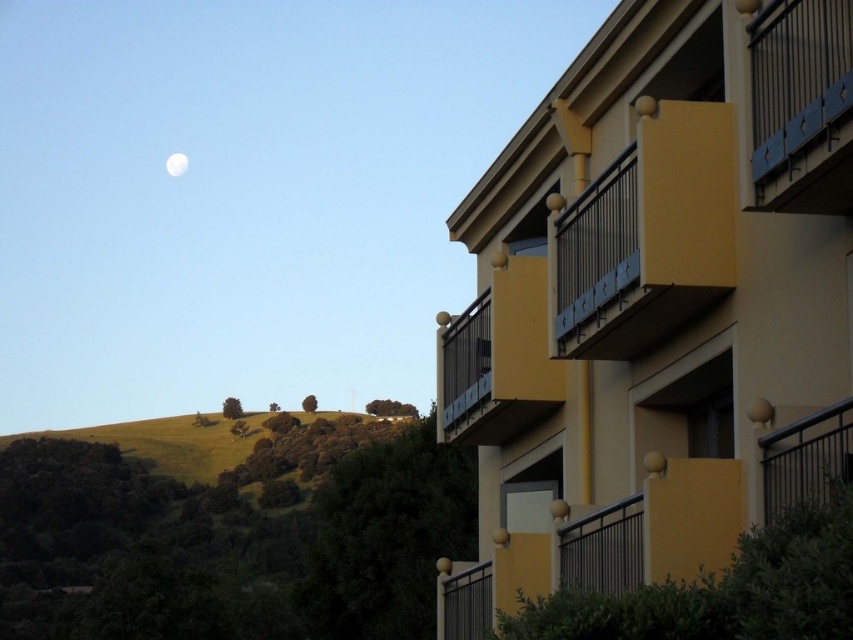
You are an architect designing a new residential building. You want to ensure that the blue painted metal railing at upper right and the white glossy moon at upper left are visible from the main entrance. Based on their sizes, which object will appear smaller in the design?

The blue painted metal railing at upper right is shorter than the white glossy moon at upper left, so it will appear smaller in the design.

You are a painter standing in front of the residential building. You need to paint both the matte yellow balcony at upper right and the blue painted metal railing at upper right. Which object should you paint first if you want to start with the one that is wider?

The matte yellow balcony at upper right might be wider than the blue painted metal railing at upper right, so you should paint the matte yellow balcony at upper right first.